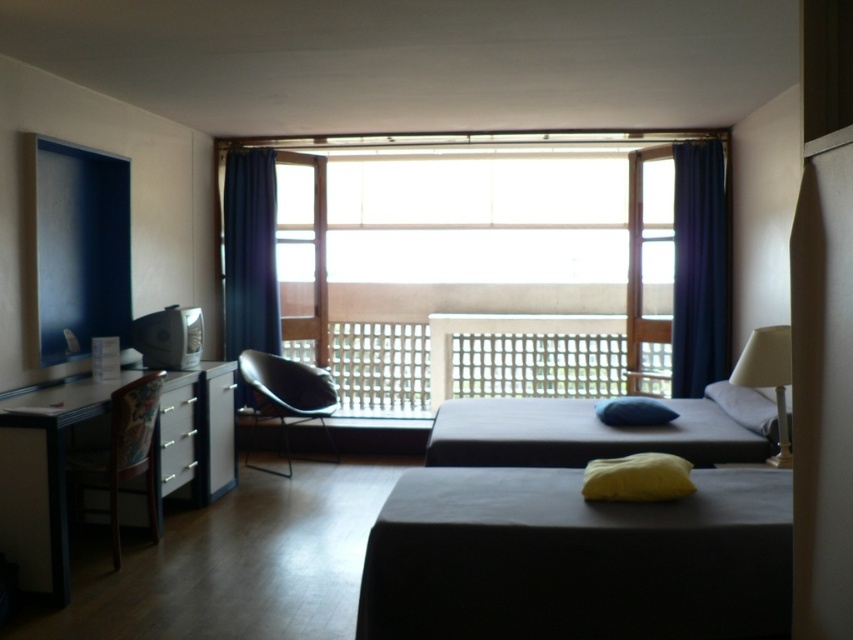
You are standing in the room and want to know how far the point at coordinate (120, 428) is from your current position. Can you determine the distance?

The point at coordinate (120, 428) is 12.92 feet away from the camera, so the distance from your current position would depend on where you are standing in the room. However, the point is 12.92 feet away from the camera, which is likely positioned at a standard viewing angle.

You are a delivery person trying to place a package between the patterned fabric armchair at left and the matte black chair at center. The package is 5 feet long. Will there be enough space to place it horizontally between them?

The distance between the patterned fabric armchair at left and the matte black chair at center is 5.12 feet, which is slightly longer than the 5 feet package. Therefore, there is enough space to place the package horizontally between them.